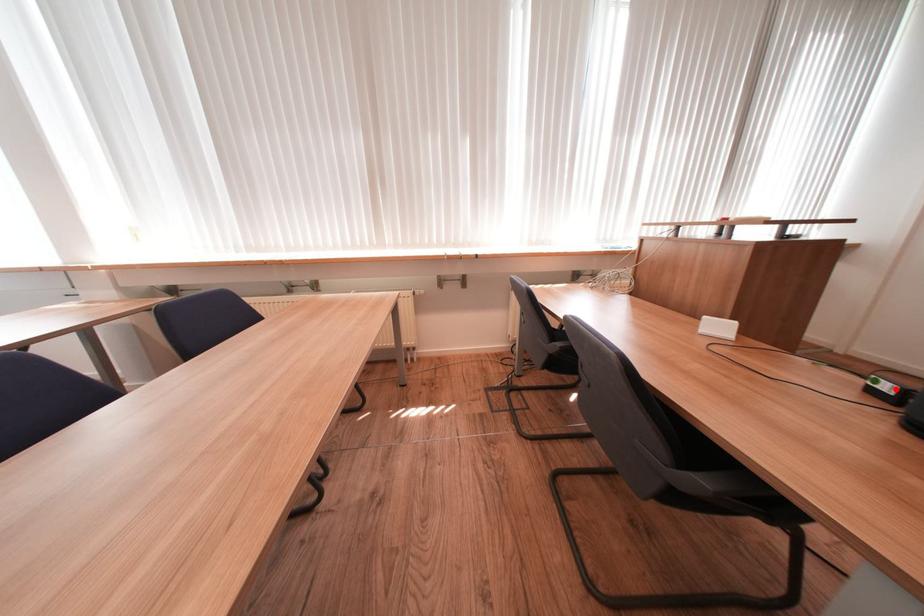
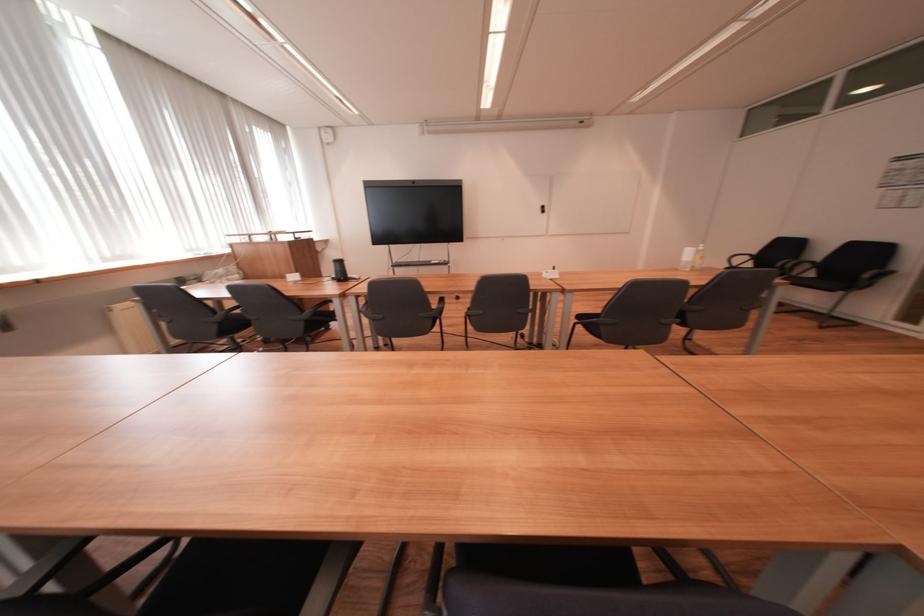
Where in the second image is the point corresponding to the highlighted location from the first image?

(343, 278)